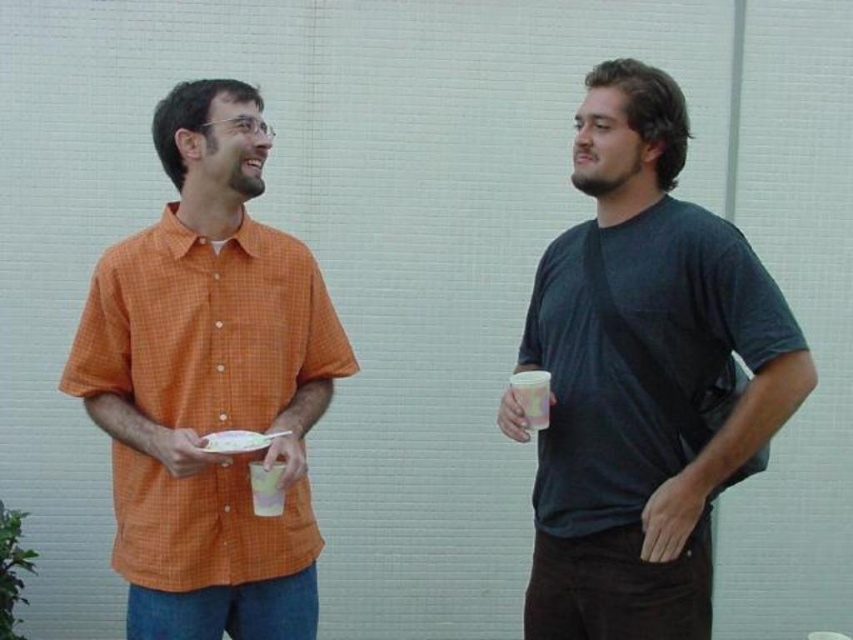
Describe the element at coordinates (643, 376) in the screenshot. I see `matte black t-shirt at right` at that location.

Does matte black t-shirt at right appear over translucent plastic cup at center?

Yes.

Identify the location of matte black t-shirt at right. The image size is (853, 640). (643, 376).

Is matte black t-shirt at right further to camera compared to orange checkered shirt at left?

No.

Who is lower down, matte black t-shirt at right or orange checkered shirt at left?

Positioned lower is orange checkered shirt at left.

Based on the photo, who is more forward, (550, 465) or (175, 573)?

Point (175, 573) is more forward.

Locate an element on the screen. matte black t-shirt at right is located at coordinates (643, 376).

Where is `orange checkered shirt at left`? The height and width of the screenshot is (640, 853). orange checkered shirt at left is located at coordinates (207, 384).

Is point (219, 250) in front of point (257, 486)?

No, (219, 250) is further to viewer.

The width and height of the screenshot is (853, 640). I want to click on orange checkered shirt at left, so click(x=207, y=384).